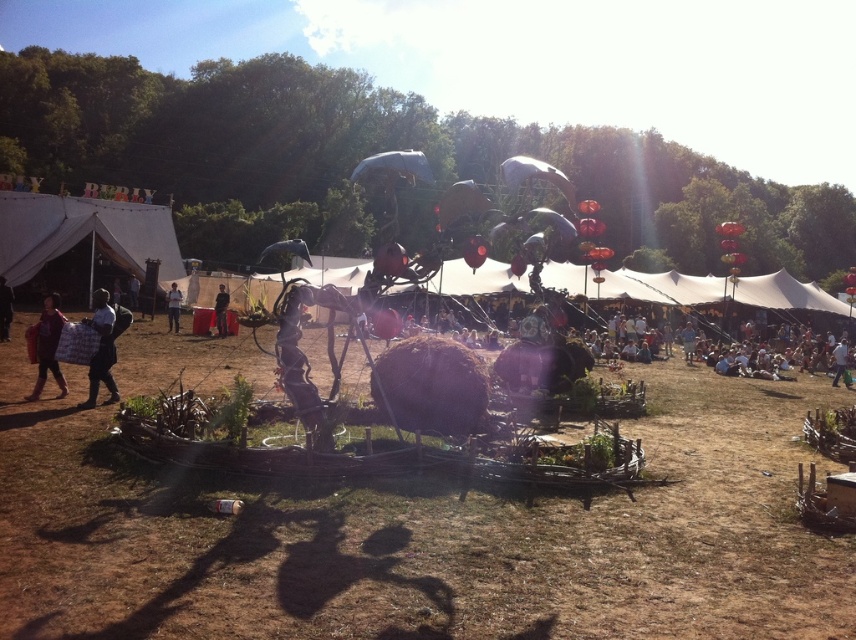
Question: Which point is closer to the camera?

Choices:
 (A) black fabric at left
 (B) matte red bag at lower left
 (C) metallic silver figure at center
 (D) white canvas tent at upper left

Answer: (A)

Question: Does white canvas tent at upper left appear under white fabric person at lower right?

Choices:
 (A) no
 (B) yes

Answer: (A)

Question: Can you confirm if metallic silver figure at center is smaller than white fabric person at lower right?

Choices:
 (A) yes
 (B) no

Answer: (A)

Question: Which of the following is the closest to the observer?

Choices:
 (A) (114, 205)
 (B) (173, 294)
 (C) (584, 563)

Answer: (C)

Question: Among these points, which one is nearest to the camera?

Choices:
 (A) (168, 316)
 (B) (45, 296)
 (C) (842, 355)

Answer: (C)

Question: Does dark blue jeans at center appear on the right side of light blue fabric at center?

Choices:
 (A) yes
 (B) no

Answer: (B)